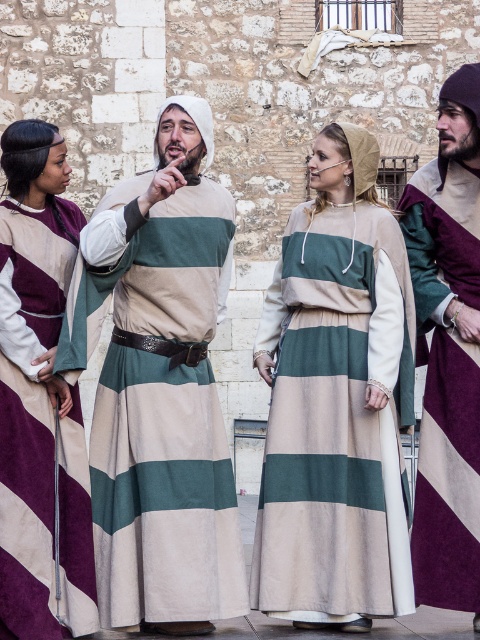
Does green striped tunic at center appear on the right side of velvet purple robe at left?

Correct, you'll find green striped tunic at center to the right of velvet purple robe at left.

Does green striped tunic at center have a lesser width compared to velvet purple robe at left?

Incorrect, green striped tunic at center's width is not less than velvet purple robe at left's.

Describe the element at coordinates (159, 387) in the screenshot. I see `green striped tunic at center` at that location.

Find the location of a particular element. The width and height of the screenshot is (480, 640). green striped tunic at center is located at coordinates (159, 387).

Can you confirm if green striped tunic at center is thinner than maroon suede tunic at right?

In fact, green striped tunic at center might be wider than maroon suede tunic at right.

Can you confirm if green striped tunic at center is positioned above maroon suede tunic at right?

Indeed, green striped tunic at center is positioned over maroon suede tunic at right.

Is point (187, 531) farther from viewer compared to point (403, 196)?

No, it is in front of (403, 196).

This screenshot has height=640, width=480. I want to click on green striped tunic at center, so click(x=159, y=387).

Which is above, velvet purple robe at left or maroon suede tunic at right?

maroon suede tunic at right is above.

Who is positioned more to the left, velvet purple robe at left or maroon suede tunic at right?

Positioned to the left is velvet purple robe at left.

This screenshot has width=480, height=640. Identify the location of velvet purple robe at left. (39, 397).

Image resolution: width=480 pixels, height=640 pixels. In order to click on velvet purple robe at left in this screenshot , I will do `click(39, 397)`.